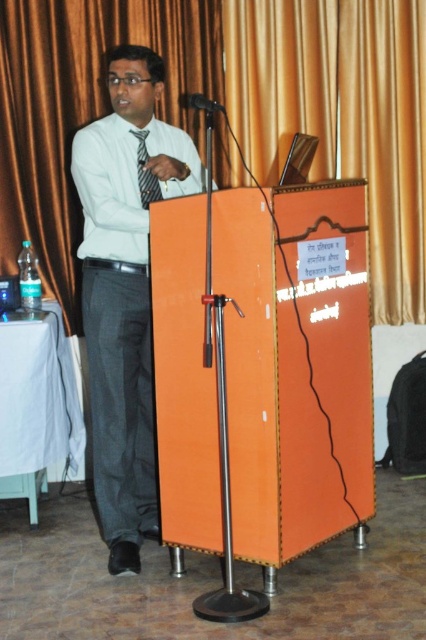
Can you confirm if striped fabric tie at center is smaller than metallic at left?

No.

Is striped fabric tie at center to the left of metallic at left from the viewer's perspective?

Correct, you'll find striped fabric tie at center to the left of metallic at left.

Which is in front, point (155, 179) or point (215, 100)?

Positioned in front is point (155, 179).

The width and height of the screenshot is (426, 640). Find the location of `striped fabric tie at center`. striped fabric tie at center is located at coordinates (146, 172).

Does orange fabric curtain at upper center have a greater width compared to striped fabric tie at center?

Indeed, orange fabric curtain at upper center has a greater width compared to striped fabric tie at center.

Is point (405, 212) behind point (138, 163)?

Yes.

This screenshot has height=640, width=426. What are the coordinates of `orange fabric curtain at upper center` in the screenshot? It's located at (342, 115).

Is matte white shirt at center taller than gold fabric curtain at upper center?

Correct, matte white shirt at center is much taller as gold fabric curtain at upper center.

Is point (137, 67) positioned after point (204, 54)?

No, (137, 67) is in front of (204, 54).

Is point (115, 268) farther from camera compared to point (71, 216)?

No, (115, 268) is closer to viewer.

The image size is (426, 640). Identify the location of matte white shirt at center. (123, 292).